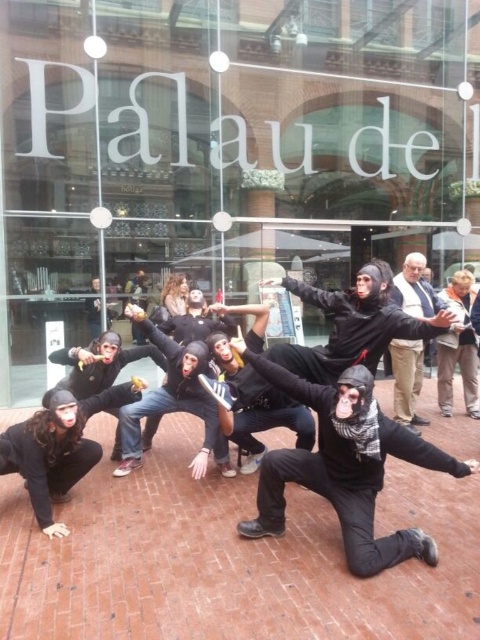
Is transparent glass shop window at center taller than khaki cotton pants at center?

Yes, transparent glass shop window at center is taller than khaki cotton pants at center.

Does transparent glass shop window at center have a larger size compared to khaki cotton pants at center?

Indeed, transparent glass shop window at center has a larger size compared to khaki cotton pants at center.

Who is more distant from viewer, (9,48) or (412,278)?

Positioned behind is point (9,48).

I want to click on transparent glass shop window at center, so point(223,147).

Which is behind, point (55, 400) or point (396, 276)?

Point (396, 276)

Is matte black mask at lower left smaller than khaki cotton pants at center?

No, matte black mask at lower left is not smaller than khaki cotton pants at center.

Does point (74, 445) come closer to viewer compared to point (408, 264)?

Yes, point (74, 445) is in front of point (408, 264).

At what (x,y) coordinates should I click in order to perform the action: click on matte black mask at lower left. Please return your answer as a coordinate pair (x, y). This screenshot has width=480, height=640. Looking at the image, I should click on tap(57, 448).

Can you confirm if transparent glass shop window at center is positioned above matte black mask at lower left?

Yes.

Between transparent glass shop window at center and matte black mask at lower left, which one has more height?

Standing taller between the two is transparent glass shop window at center.

Is point (403, 13) farther from viewer compared to point (61, 432)?

Yes, point (403, 13) is farther from viewer.

Locate an element on the screen. Image resolution: width=480 pixels, height=640 pixels. transparent glass shop window at center is located at coordinates (223, 147).